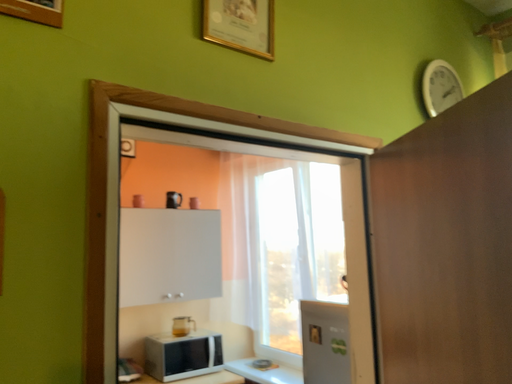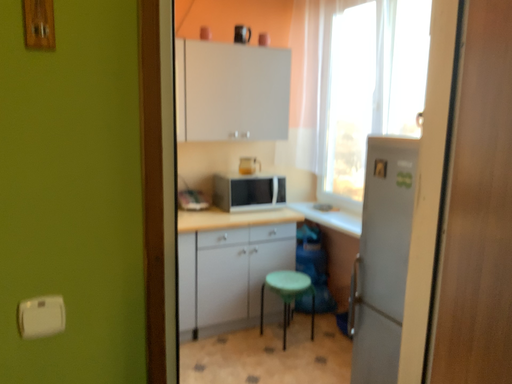
Question: Which way did the camera rotate in the video?

Choices:
 (A) rotated right
 (B) rotated left

Answer: (B)